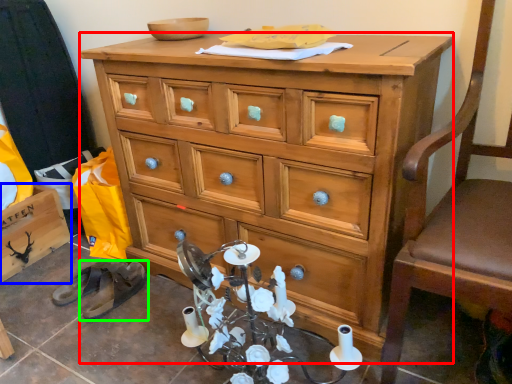
Question: Estimate the real-world distances between objects in this image. Which object is closer to chest of drawers (highlighted by a red box), cabinetry (highlighted by a blue box) or footwear (highlighted by a green box)?

Choices:
 (A) cabinetry
 (B) footwear

Answer: (B)